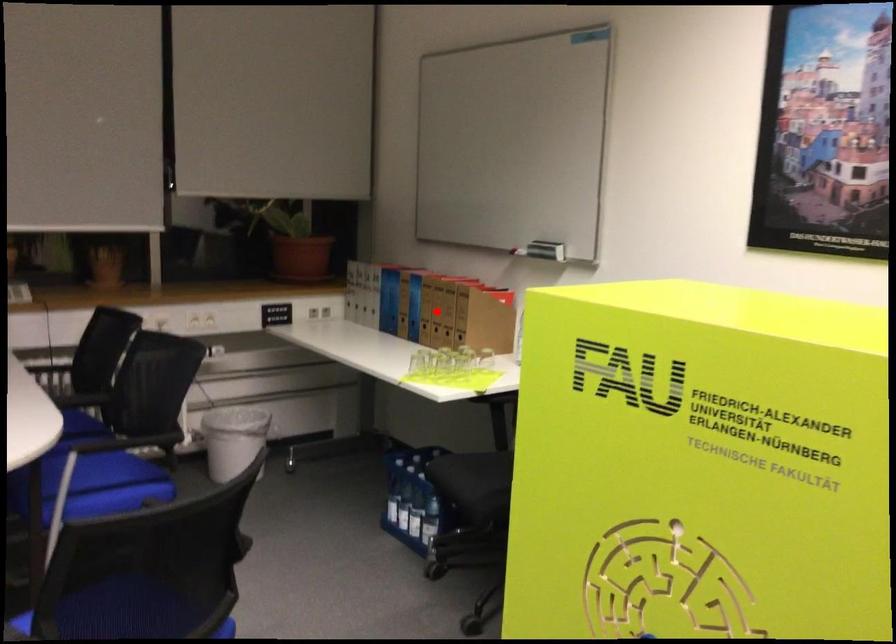
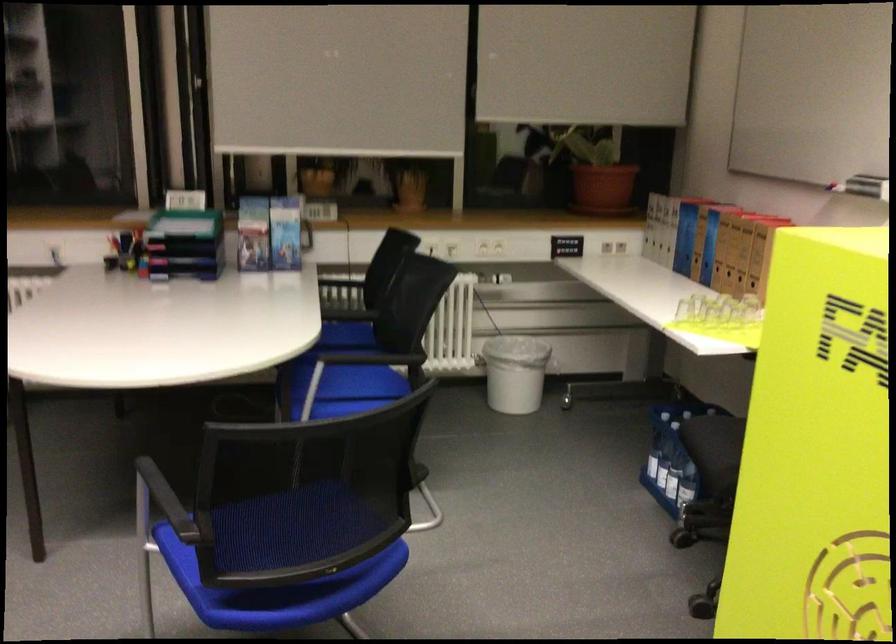
In the second image, find the point that corresponds to the highlighted location in the first image.

(730, 251)